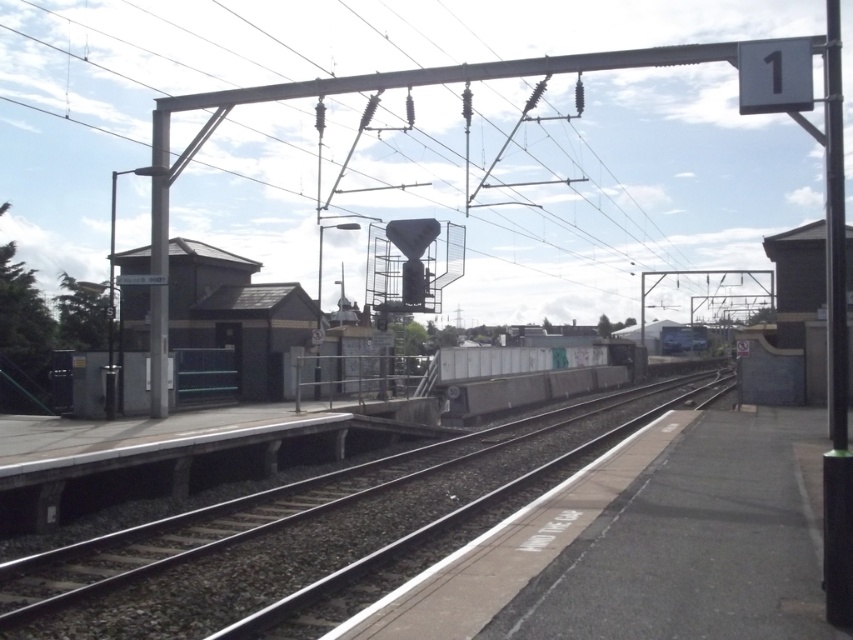
Can you confirm if smooth concrete train track at center is positioned below metallic pole at left?

Yes.

Where is `smooth concrete train track at center`? This screenshot has height=640, width=853. smooth concrete train track at center is located at coordinates (302, 531).

The width and height of the screenshot is (853, 640). I want to click on smooth concrete train track at center, so click(302, 531).

Locate an element on the screen. smooth concrete train track at center is located at coordinates (302, 531).

Between metallic pole at left and silver metallic train at center, which one is positioned lower?

Positioned lower is silver metallic train at center.

Is metallic pole at left smaller than silver metallic train at center?

No.

Does point (154, 316) come closer to viewer compared to point (689, 324)?

Yes.

Where is `metallic pole at left`? Image resolution: width=853 pixels, height=640 pixels. metallic pole at left is located at coordinates (158, 262).

Is smooth concrete train track at center bigger than black metal pole at right?

Actually, smooth concrete train track at center might be smaller than black metal pole at right.

Locate an element on the screen. The image size is (853, 640). smooth concrete train track at center is located at coordinates (302, 531).